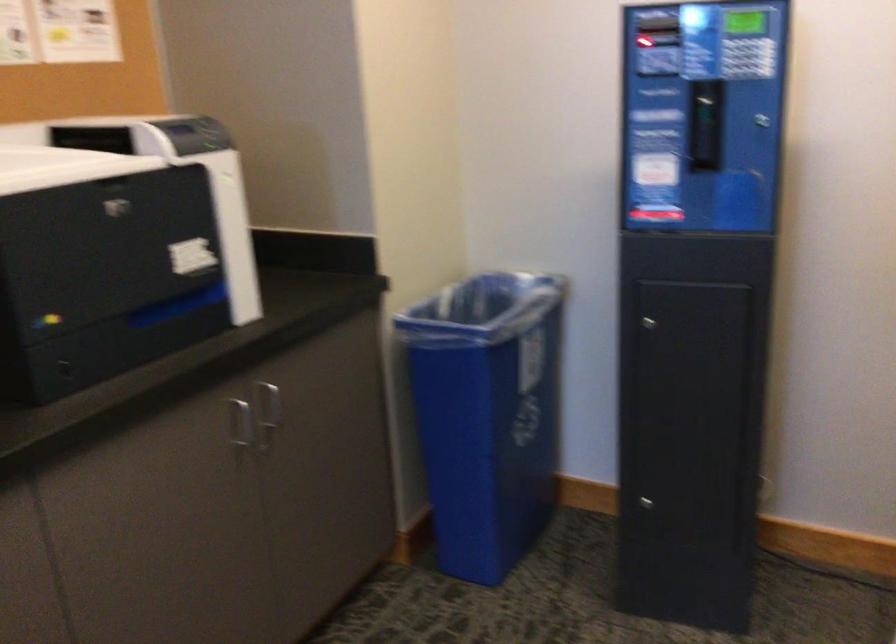
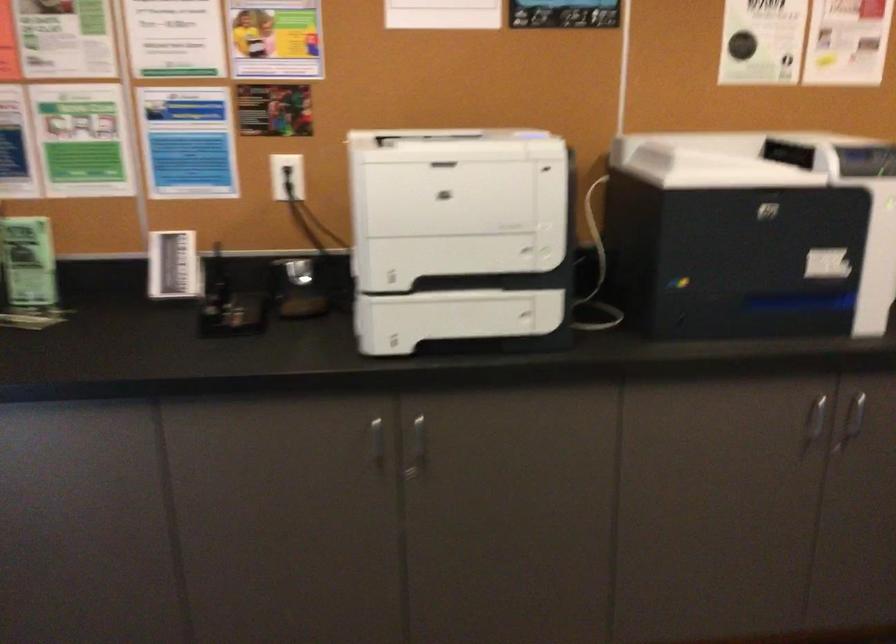
The point at (268, 408) is marked in the first image. Where is the corresponding point in the second image?

(853, 418)